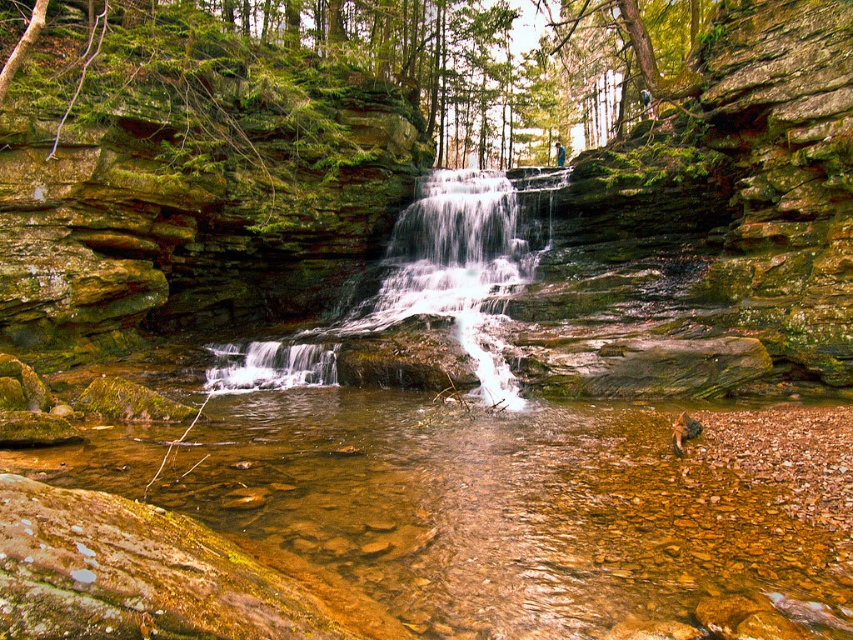
Which of these two, clear water at center or translucent glass waterfall at center, stands shorter?

With less height is clear water at center.

Is the position of clear water at center less distant than that of translucent glass waterfall at center?

Yes, clear water at center is in front of translucent glass waterfall at center.

What do you see at coordinates (415, 529) in the screenshot?
I see `clear water at center` at bounding box center [415, 529].

In order to click on clear water at center in this screenshot , I will do (x=415, y=529).